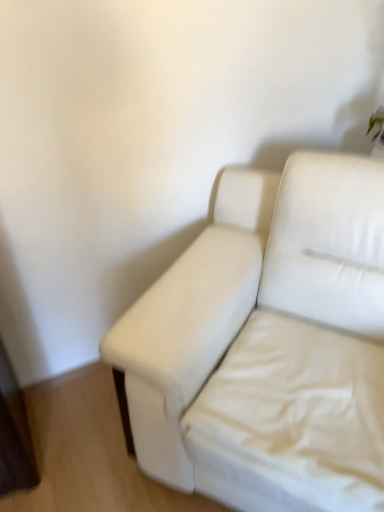
Question: Would you consider white fabric couch at center to be distant from white fabric sheet at lower right?

Choices:
 (A) no
 (B) yes

Answer: (A)

Question: Considering the relative sizes of white fabric couch at center and white fabric sheet at lower right in the image provided, is white fabric couch at center thinner than white fabric sheet at lower right?

Choices:
 (A) no
 (B) yes

Answer: (A)

Question: Is white fabric couch at center beside white fabric sheet at lower right?

Choices:
 (A) no
 (B) yes

Answer: (B)

Question: Is white fabric couch at center positioned in front of white fabric sheet at lower right?

Choices:
 (A) yes
 (B) no

Answer: (A)

Question: Is white fabric couch at center to the right of white fabric sheet at lower right from the viewer's perspective?

Choices:
 (A) yes
 (B) no

Answer: (B)

Question: Is white fabric sheet at lower right inside white fabric couch at center?

Choices:
 (A) yes
 (B) no

Answer: (A)

Question: Considering the relative positions of white fabric sheet at lower right and white fabric couch at center in the image provided, is white fabric sheet at lower right in front of white fabric couch at center?

Choices:
 (A) no
 (B) yes

Answer: (A)

Question: Is white fabric sheet at lower right wider than white fabric couch at center?

Choices:
 (A) no
 (B) yes

Answer: (A)

Question: Is white fabric sheet at lower right to the left of white fabric couch at center from the viewer's perspective?

Choices:
 (A) no
 (B) yes

Answer: (A)

Question: Does white fabric sheet at lower right appear on the right side of white fabric couch at center?

Choices:
 (A) no
 (B) yes

Answer: (B)

Question: Could you tell me if white fabric sheet at lower right is turned towards white fabric couch at center?

Choices:
 (A) no
 (B) yes

Answer: (B)

Question: Is white fabric sheet at lower right smaller than white fabric couch at center?

Choices:
 (A) no
 (B) yes

Answer: (B)

Question: In terms of size, does white fabric couch at center appear bigger or smaller than white fabric sheet at lower right?

Choices:
 (A) small
 (B) big

Answer: (B)